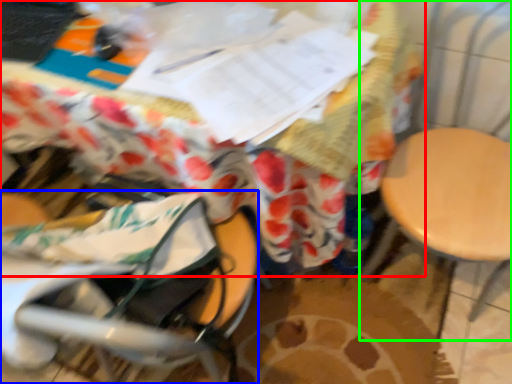
Question: Estimate the real-world distances between objects in this image. Which object is closer to table (highlighted by a red box), baby carriage (highlighted by a blue box) or swivel chair (highlighted by a green box)?

Choices:
 (A) baby carriage
 (B) swivel chair

Answer: (A)